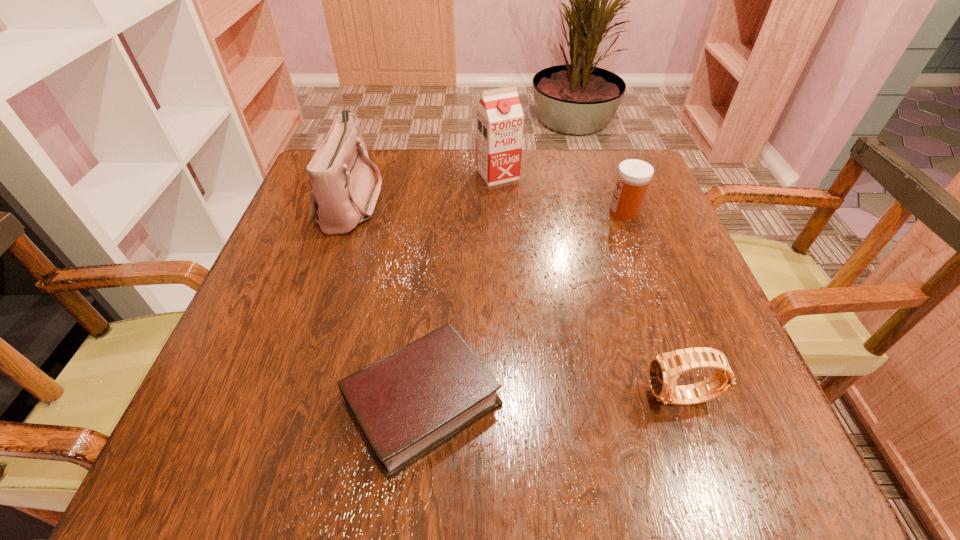
Locate an element on the screen. This screenshot has width=960, height=540. vacant region between the Bible and the soya milk is located at coordinates (460, 287).

Locate which object is the closest to the shoulder bag. Please provide its 2D coordinates. Your answer should be formatted as a tuple, i.e. [(x, y)], where the tuple contains the x and y coordinates of a point satisfying the conditions above.

[(499, 116)]

Select which object appears as the fourth closest to the shoulder bag. Please provide its 2D coordinates. Your answer should be formatted as a tuple, i.e. [(x, y)], where the tuple contains the x and y coordinates of a point satisfying the conditions above.

[(664, 369)]

Locate an element on the screen. The height and width of the screenshot is (540, 960). free location that satisfies the following two spatial constraints: 1. on the front pocket of the shoulder bag; 2. on the right side of the medicine is located at coordinates (348, 212).

Find the location of a particular element. Image resolution: width=960 pixels, height=540 pixels. vacant space that satisfies the following two spatial constraints: 1. on the back side of the tallest object; 2. on the left side of the Bible is located at coordinates (444, 174).

This screenshot has width=960, height=540. Find the location of `free spot that satisfies the following two spatial constraints: 1. on the front pocket of the leftmost object; 2. on the back side of the medicine`. free spot that satisfies the following two spatial constraints: 1. on the front pocket of the leftmost object; 2. on the back side of the medicine is located at coordinates (348, 212).

This screenshot has height=540, width=960. Identify the location of vacant position in the image that satisfies the following two spatial constraints: 1. on the back side of the soya milk; 2. on the right side of the Bible. (444, 174).

Locate an element on the screen. This screenshot has height=540, width=960. free spot that satisfies the following two spatial constraints: 1. on the front pocket of the medicine; 2. on the right side of the shoulder bag is located at coordinates (348, 212).